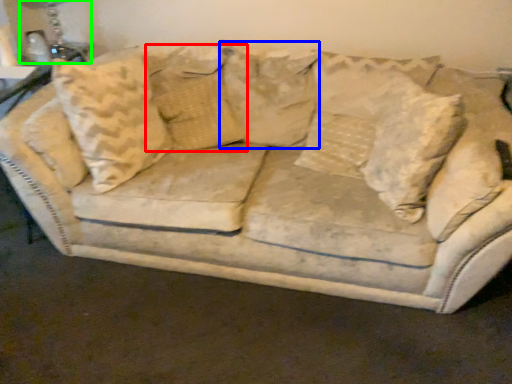
Question: Based on their relative distances, which object is farther from pillow (highlighted by a red box)? Choose from pillow (highlighted by a blue box) and table lamp (highlighted by a green box).

Choices:
 (A) pillow
 (B) table lamp

Answer: (B)